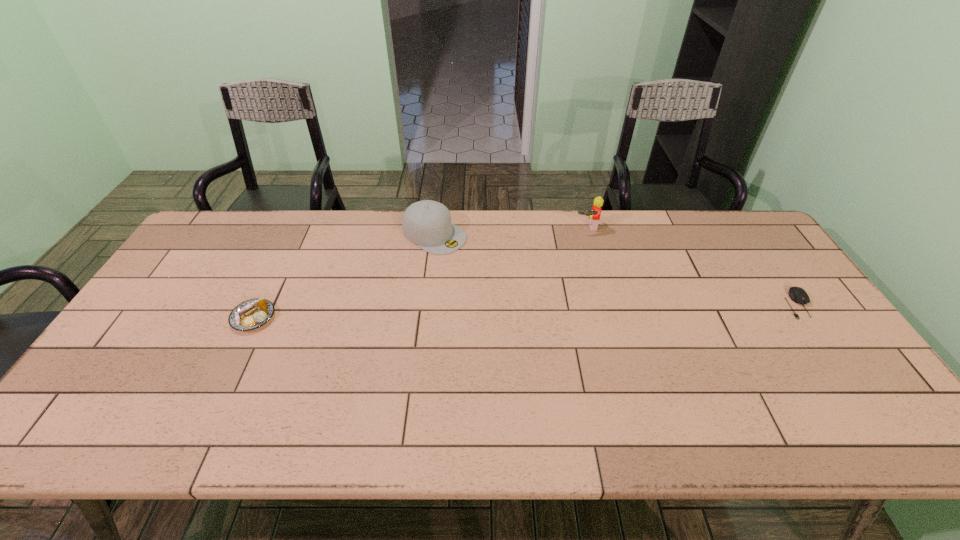
Where is `blank area located in front of the third object from left to right with the accessory visible`? The image size is (960, 540). blank area located in front of the third object from left to right with the accessory visible is located at coordinates (590, 248).

Where is `vacant space located 0.170m in front of the third object from left to right with the accessory visible`? This screenshot has height=540, width=960. vacant space located 0.170m in front of the third object from left to right with the accessory visible is located at coordinates (594, 267).

You are a GUI agent. You are given a task and a screenshot of the screen. Output one action in this format:
    pyautogui.click(x=<x>, y=<y>)
    Task: Click on the free space located in front of the third object from left to right with the accessory visible
    The width and height of the screenshot is (960, 540).
    Given the screenshot: What is the action you would take?
    pyautogui.click(x=593, y=261)

At what (x,y) coordinates should I click in order to perform the action: click on free region located 0.380m on the front-facing side of the second tallest object. Please return your answer as a coordinate pair (x, y). Looking at the image, I should click on (554, 307).

At what (x,y) coordinates should I click in order to perform the action: click on free space located 0.240m on the front-facing side of the second tallest object. Please return your answer as a coordinate pair (x, y). The width and height of the screenshot is (960, 540). Looking at the image, I should click on (516, 284).

Find the location of a particular element. blank space located on the front-facing side of the second tallest object is located at coordinates 508,279.

Locate an element on the screen. Lego at the far edge is located at coordinates click(x=594, y=214).

This screenshot has height=540, width=960. I want to click on cap located in the far edge section of the desktop, so click(427, 223).

At what (x,y) coordinates should I click in order to perform the action: click on object at the right edge. Please return your answer as a coordinate pair (x, y). Looking at the image, I should click on (798, 295).

At what (x,y) coordinates should I click in order to perform the action: click on vacant region at the far edge of the desktop. Please return your answer as a coordinate pair (x, y). Looking at the image, I should click on (685, 235).